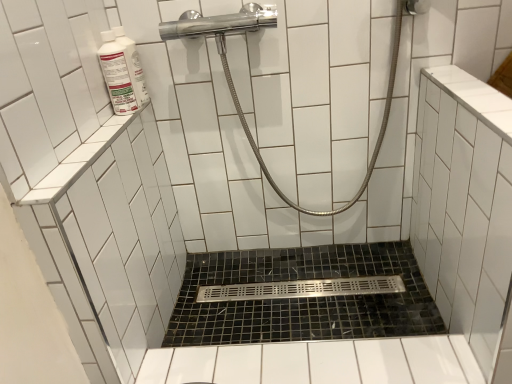
Question: From the image's perspective, is polished chrome showerhead at upper center positioned above or below white glossy bottle at upper left, the 1th cleaning product positioned from the back?

Choices:
 (A) below
 (B) above

Answer: (A)

Question: Based on their sizes in the image, would you say polished chrome showerhead at upper center is bigger or smaller than white glossy bottle at upper left, which is the 2th cleaning product from front to back?

Choices:
 (A) small
 (B) big

Answer: (B)

Question: Estimate the real-world distances between objects in this image. Which object is farther from the black mosaic tile bath at center?

Choices:
 (A) polished chrome showerhead at upper center
 (B) white glossy bottle at upper left, the first cleaning product from the front
 (C) white glossy bottle at upper left, the 1th cleaning product positioned from the back

Answer: (B)

Question: Based on their relative distances, which object is farther from the black mosaic tile bath at center?

Choices:
 (A) white glossy bottle at upper left, which is the 2th cleaning product from front to back
 (B) polished chrome showerhead at upper center
 (C) white glossy bottle at upper left, arranged as the second cleaning product when viewed from the back

Answer: (C)